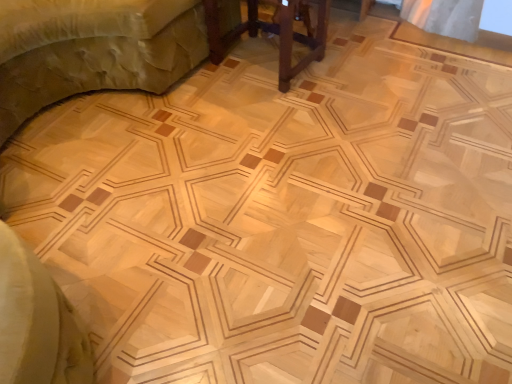
Question: In terms of width, does brown wooden table at center, which ranks as the first furniture in right-to-left order, look wider or thinner when compared to wooden bed at upper left, arranged as the 1th furniture when viewed from the left?

Choices:
 (A) thin
 (B) wide

Answer: (A)

Question: From the image's perspective, is brown wooden table at center, the second furniture when ordered from left to right, above or below wooden bed at upper left, arranged as the 1th furniture when viewed from the left?

Choices:
 (A) below
 (B) above

Answer: (A)

Question: Is brown wooden table at center, the second furniture when ordered from left to right, spatially inside wooden bed at upper left, the second furniture positioned from the right, or outside of it?

Choices:
 (A) inside
 (B) outside

Answer: (B)

Question: Is wooden bed at upper left, arranged as the 1th furniture when viewed from the left, wider or thinner than brown wooden table at center, which ranks as the first furniture in right-to-left order?

Choices:
 (A) wide
 (B) thin

Answer: (A)

Question: Visually, is wooden bed at upper left, arranged as the 1th furniture when viewed from the left, positioned to the left or to the right of brown wooden table at center, which ranks as the first furniture in right-to-left order?

Choices:
 (A) left
 (B) right

Answer: (A)

Question: Which is correct: wooden bed at upper left, the second furniture positioned from the right, is inside brown wooden table at center, which ranks as the first furniture in right-to-left order, or outside of it?

Choices:
 (A) inside
 (B) outside

Answer: (B)

Question: In terms of height, does wooden bed at upper left, the second furniture positioned from the right, look taller or shorter compared to brown wooden table at center, which ranks as the first furniture in right-to-left order?

Choices:
 (A) short
 (B) tall

Answer: (B)